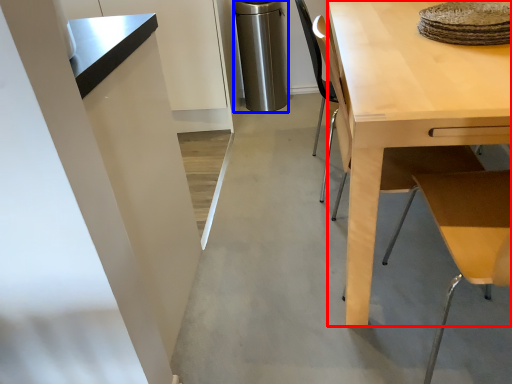
Question: Which of the following is the farthest to the observer, desk (highlighted by a red box) or appliance (highlighted by a blue box)?

Choices:
 (A) desk
 (B) appliance

Answer: (B)